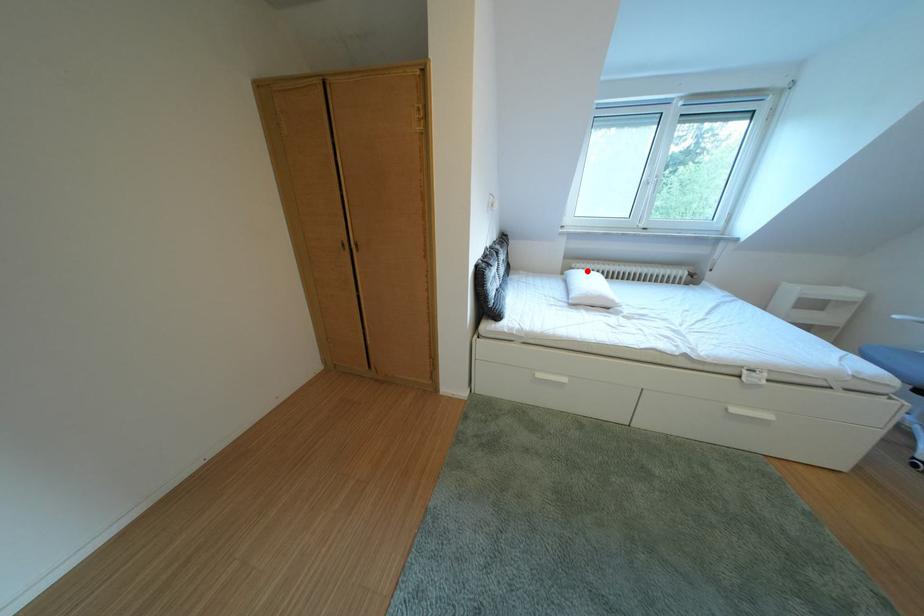
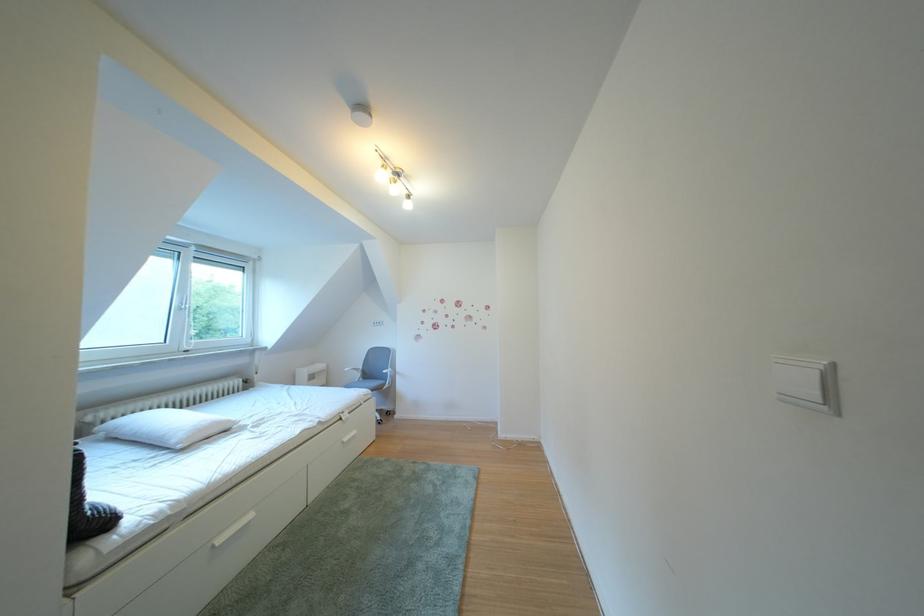
Question: I am providing you with two images of the same scene from different viewpoints. A red point is shown in image1. For the corresponding object point in image2, is it positioned nearer or farther from the camera?

Choices:
 (A) Nearer
 (B) Farther

Answer: (B)